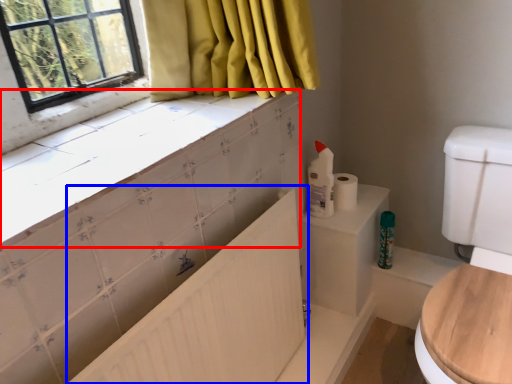
Question: Which of the following is the farthest to the observer, counter top (highlighted by a red box) or bath (highlighted by a blue box)?

Choices:
 (A) counter top
 (B) bath

Answer: (B)